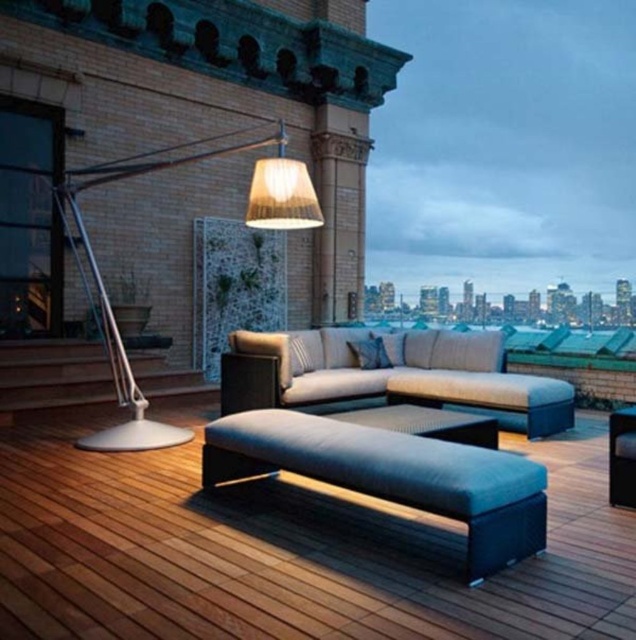
Question: Which object is the closest to the velvet dark blue bench at center?

Choices:
 (A) metallic silver floor lamp at upper left
 (B) matte black ottoman at center
 (C) textured beige couch at center

Answer: (B)

Question: Among these objects, which one is farthest from the camera?

Choices:
 (A) velvet dark blue bench at center
 (B) matte black ottoman at center
 (C) metallic silver floor lamp at upper left

Answer: (C)

Question: Is matte black ottoman at center bigger than metallic silver floor lamp at upper left?

Choices:
 (A) no
 (B) yes

Answer: (A)

Question: Does textured beige couch at center have a smaller size compared to metallic silver floor lamp at upper left?

Choices:
 (A) yes
 (B) no

Answer: (B)

Question: In this image, where is matte black ottoman at center located relative to textured beige couch at center?

Choices:
 (A) above
 (B) below

Answer: (B)

Question: Which object appears closest to the camera in this image?

Choices:
 (A) velvet dark blue bench at center
 (B) metallic silver floor lamp at upper left
 (C) textured beige couch at center

Answer: (A)